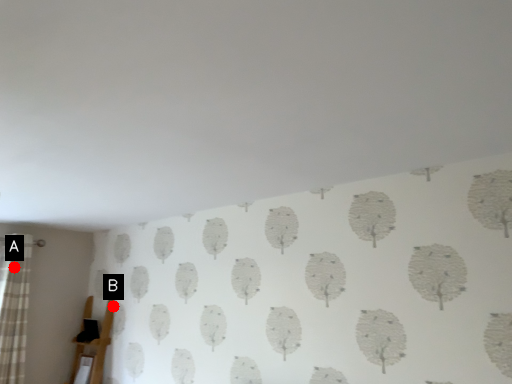
Question: Two points are circled on the image, labeled by A and B beside each circle. Which point is closer to the camera?

Choices:
 (A) A is closer
 (B) B is closer

Answer: (A)